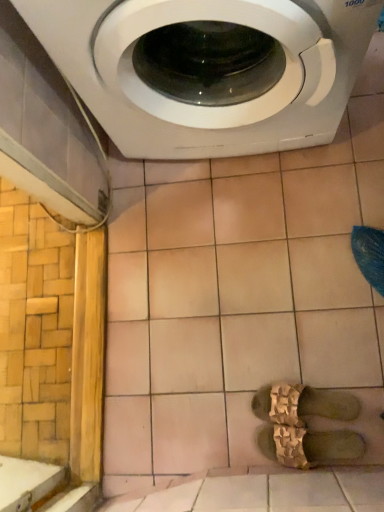
I want to click on unoccupied space behind brown textured sandals at center, acting as the first shoe starting from the bottom, so click(x=253, y=371).